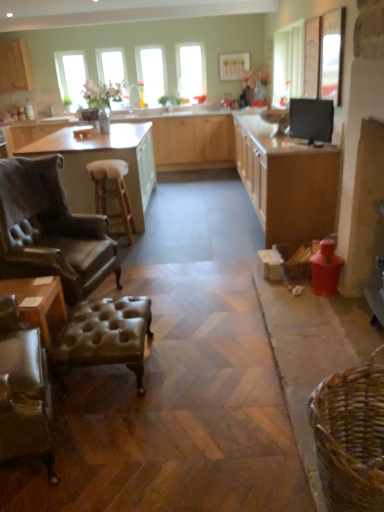
Question: Does brown woven basket at lower right appear on the left side of white leather stool at center?

Choices:
 (A) yes
 (B) no

Answer: (B)

Question: Are brown woven basket at lower right and white leather stool at center far apart?

Choices:
 (A) no
 (B) yes

Answer: (B)

Question: Does brown woven basket at lower right touch white leather stool at center?

Choices:
 (A) yes
 (B) no

Answer: (B)

Question: Does brown woven basket at lower right have a lesser height compared to white leather stool at center?

Choices:
 (A) no
 (B) yes

Answer: (B)

Question: From the image's perspective, is brown woven basket at lower right under white leather stool at center?

Choices:
 (A) no
 (B) yes

Answer: (B)

Question: Is brown woven basket at lower right smaller than white leather stool at center?

Choices:
 (A) no
 (B) yes

Answer: (B)

Question: From the image's perspective, is clear glass window at upper center, acting as the 1th window starting from the right, located above black glossy monitor at upper right?

Choices:
 (A) no
 (B) yes

Answer: (B)

Question: From the image's perspective, would you say clear glass window at upper center, which is counted as the third window, starting from the left, is shown under black glossy monitor at upper right?

Choices:
 (A) no
 (B) yes

Answer: (A)

Question: From a real-world perspective, is clear glass window at upper center, acting as the 1th window starting from the right, physically above black glossy monitor at upper right?

Choices:
 (A) yes
 (B) no

Answer: (A)

Question: Can you confirm if clear glass window at upper center, acting as the 1th window starting from the right, is smaller than black glossy monitor at upper right?

Choices:
 (A) yes
 (B) no

Answer: (B)

Question: Is clear glass window at upper center, acting as the 1th window starting from the right, not near black glossy monitor at upper right?

Choices:
 (A) no
 (B) yes

Answer: (B)

Question: From a real-world perspective, does clear glass window at upper center, acting as the 1th window starting from the right, sit lower than black glossy monitor at upper right?

Choices:
 (A) no
 (B) yes

Answer: (A)

Question: Are brown leather table at left, which is the 2th table from front to back, and matte wood countertop at center located far from each other?

Choices:
 (A) no
 (B) yes

Answer: (B)